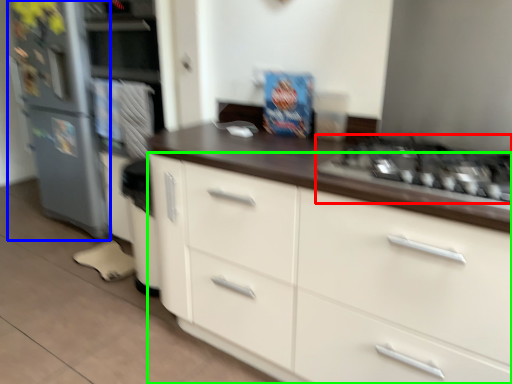
Question: Based on their relative distances, which object is nearer to gas stove (highlighted by a red box)? Choose from refrigerator (highlighted by a blue box) and cabinetry (highlighted by a green box).

Choices:
 (A) refrigerator
 (B) cabinetry

Answer: (B)